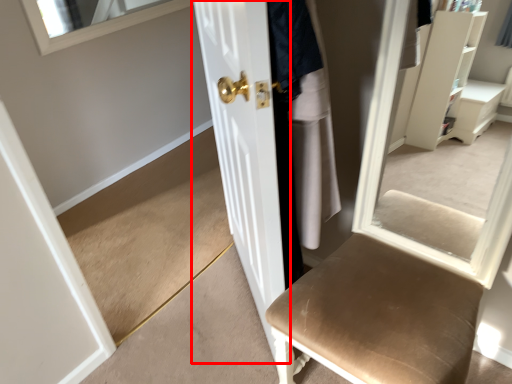
Question: Considering the relative positions of door (annotated by the red box) and clothing in the image provided, where is door (annotated by the red box) located with respect to the staircase?

Choices:
 (A) right
 (B) left

Answer: (B)